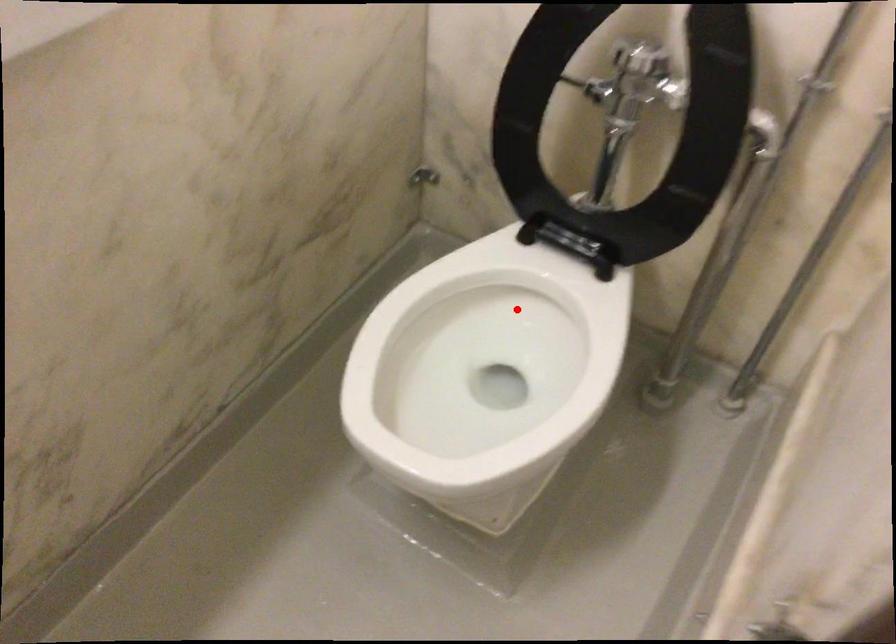
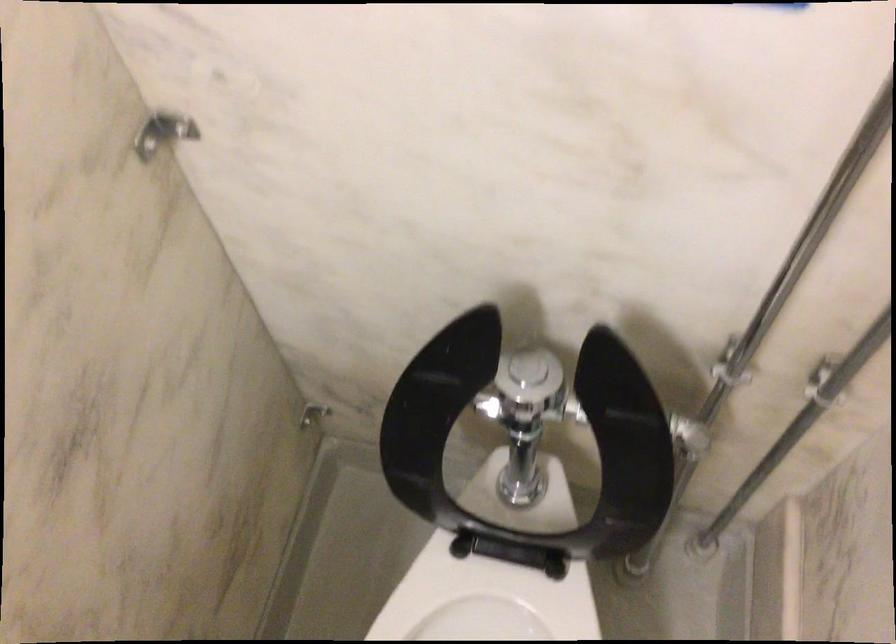
Question: I am providing you with two images of the same scene from different viewpoints. Image1 has a red point marked. In image2, the corresponding 3D location appears at what relative position? Reply with the corresponding letter.

Choices:
 (A) Closer
 (B) Farther

Answer: (A)